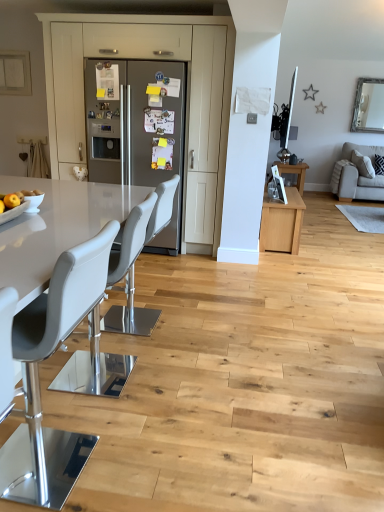
Locate an element on the screen. free spot below white leather chair at center, the 1th chair viewed from the back (from a real-world perspective) is located at coordinates (139, 324).